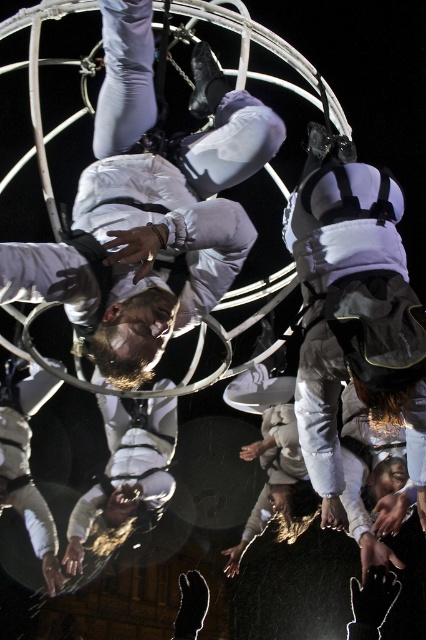
Question: Where is white matte astronaut at center located in relation to matte white astronaut at center in the image?

Choices:
 (A) above
 (B) below

Answer: (A)

Question: Which object is farther from the camera taking this photo?

Choices:
 (A) white matte astronaut at center
 (B) matte white astronaut at center

Answer: (B)

Question: Among these points, which one is nearest to the camera?

Choices:
 (A) (207, 138)
 (B) (123, 490)

Answer: (A)

Question: Does white matte astronaut at center have a lesser width compared to matte white astronaut at center?

Choices:
 (A) yes
 (B) no

Answer: (B)

Question: Can you confirm if white matte astronaut at center is positioned above matte white astronaut at center?

Choices:
 (A) no
 (B) yes

Answer: (B)